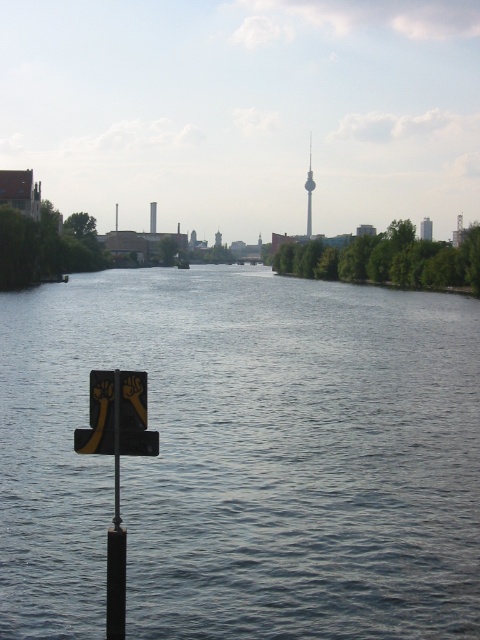
Who is positioned more to the left, yellow matte parking sign at lower left or black metal pole at lower left?

Positioned to the left is yellow matte parking sign at lower left.

Is yellow matte parking sign at lower left positioned in front of black metal pole at lower left?

No, it is not.

Describe the element at coordinates (133, 417) in the screenshot. Image resolution: width=480 pixels, height=640 pixels. I see `yellow matte parking sign at lower left` at that location.

Locate an element on the screen. The width and height of the screenshot is (480, 640). yellow matte parking sign at lower left is located at coordinates (133, 417).

Identify the location of blue water at center. This screenshot has width=480, height=640. (243, 458).

Does blue water at center appear under black metal pole at lower left?

Actually, blue water at center is above black metal pole at lower left.

Is point (144, 472) farther from camera compared to point (117, 595)?

Yes, it is behind point (117, 595).

Where is `blue water at center`? Image resolution: width=480 pixels, height=640 pixels. blue water at center is located at coordinates (243, 458).

Does blue water at center lie in front of yellow matte parking sign at lower left?

No, blue water at center is further to the viewer.

Does blue water at center have a smaller size compared to yellow matte parking sign at lower left?

Incorrect, blue water at center is not smaller in size than yellow matte parking sign at lower left.

Between point (251, 323) and point (103, 371), which one is positioned in front?

Point (103, 371) is more forward.

You are a GUI agent. You are given a task and a screenshot of the screen. Output one action in this format:
    pyautogui.click(x=<x>, y=<y>)
    Task: Click on the blue water at center
    This screenshot has width=480, height=640.
    Given the screenshot: What is the action you would take?
    pyautogui.click(x=243, y=458)